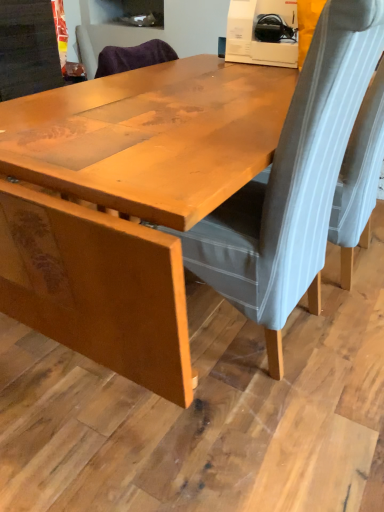
Question: Is velvet grey chair at center, the 1th chair in the left-to-right sequence, not inside gray fabric chair at right, the second chair when ordered from left to right?

Choices:
 (A) no
 (B) yes

Answer: (B)

Question: Considering the relative positions of velvet grey chair at center, the 1th chair in the left-to-right sequence, and gray fabric chair at right, the second chair when ordered from left to right, in the image provided, is velvet grey chair at center, the 1th chair in the left-to-right sequence, to the left of gray fabric chair at right, the second chair when ordered from left to right, from the viewer's perspective?

Choices:
 (A) no
 (B) yes

Answer: (B)

Question: Does velvet grey chair at center, the second chair in the right-to-left sequence, have a lesser height compared to gray fabric chair at right, the 1th chair when ordered from right to left?

Choices:
 (A) no
 (B) yes

Answer: (A)

Question: Is velvet grey chair at center, the second chair in the right-to-left sequence, further to the viewer compared to gray fabric chair at right, the 1th chair when ordered from right to left?

Choices:
 (A) no
 (B) yes

Answer: (A)

Question: Considering the relative sizes of velvet grey chair at center, the 1th chair in the left-to-right sequence, and gray fabric chair at right, the 1th chair when ordered from right to left, in the image provided, is velvet grey chair at center, the 1th chair in the left-to-right sequence, wider than gray fabric chair at right, the 1th chair when ordered from right to left,?

Choices:
 (A) no
 (B) yes

Answer: (B)

Question: Is gray fabric chair at right, the second chair when ordered from left to right, taller or shorter than velvet grey chair at center, the 1th chair in the left-to-right sequence?

Choices:
 (A) tall
 (B) short

Answer: (B)

Question: Based on their positions, is gray fabric chair at right, the second chair when ordered from left to right, located to the left or right of velvet grey chair at center, the 1th chair in the left-to-right sequence?

Choices:
 (A) left
 (B) right

Answer: (B)

Question: Which is correct: gray fabric chair at right, the second chair when ordered from left to right, is inside velvet grey chair at center, the second chair in the right-to-left sequence, or outside of it?

Choices:
 (A) outside
 (B) inside

Answer: (A)

Question: In terms of size, does gray fabric chair at right, the 1th chair when ordered from right to left, appear bigger or smaller than velvet grey chair at center, the 1th chair in the left-to-right sequence?

Choices:
 (A) big
 (B) small

Answer: (B)

Question: From the image's perspective, is gray fabric chair at right, the 1th chair when ordered from right to left, located above or below wooden table at center?

Choices:
 (A) below
 (B) above

Answer: (B)

Question: Considering the positions of gray fabric chair at right, the second chair when ordered from left to right, and wooden table at center in the image, is gray fabric chair at right, the second chair when ordered from left to right, wider or thinner than wooden table at center?

Choices:
 (A) wide
 (B) thin

Answer: (B)

Question: In terms of size, does gray fabric chair at right, the second chair when ordered from left to right, appear bigger or smaller than wooden table at center?

Choices:
 (A) big
 (B) small

Answer: (B)

Question: Visually, is gray fabric chair at right, the second chair when ordered from left to right, positioned to the left or to the right of wooden table at center?

Choices:
 (A) right
 (B) left

Answer: (A)

Question: Looking at their shapes, would you say velvet grey chair at center, the second chair in the right-to-left sequence, is wider or thinner than gray fabric chair at right, the 1th chair when ordered from right to left?

Choices:
 (A) wide
 (B) thin

Answer: (A)

Question: Does point (213, 216) appear closer or farther from the camera than point (382, 68)?

Choices:
 (A) closer
 (B) farther

Answer: (B)